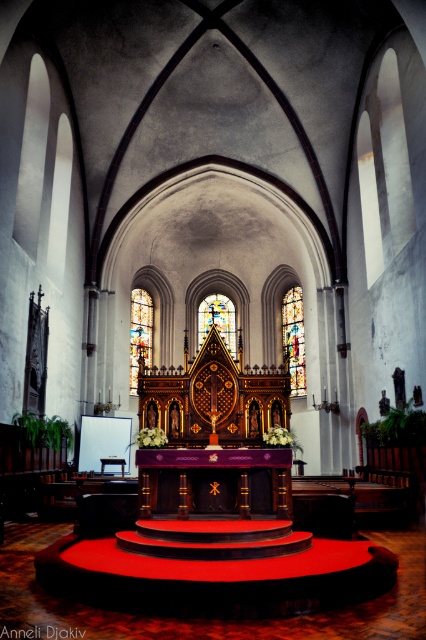
You are a maintenance worker tasked with cleaning the stained glass at upper center and the stained glass window at center. Given that your ladder can reach up to 30 feet, can you safely clean both without moving the ladder?

The stained glass at upper center and stained glass window at center are 41.11 feet apart from each other. Since your ladder can only reach up to 30 feet, you cannot safely clean both without moving the ladder because the distance between them exceeds the ladder reach.

You are standing in the church and want to know how far the point at coordinates (293, 378) is from you. Can you determine the distance?

The point at coordinates (293, 378) is 93.79 meters away from the viewer.